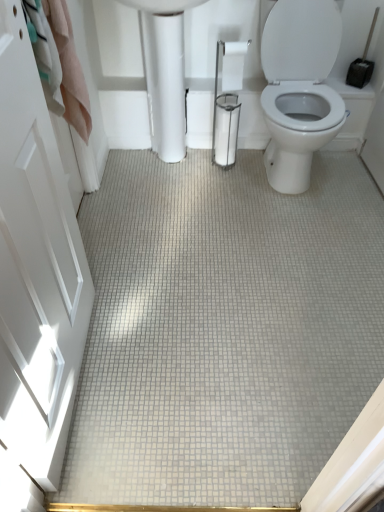
Identify the location of vacant space to the right of white glossy door at left. Image resolution: width=384 pixels, height=512 pixels. (175, 379).